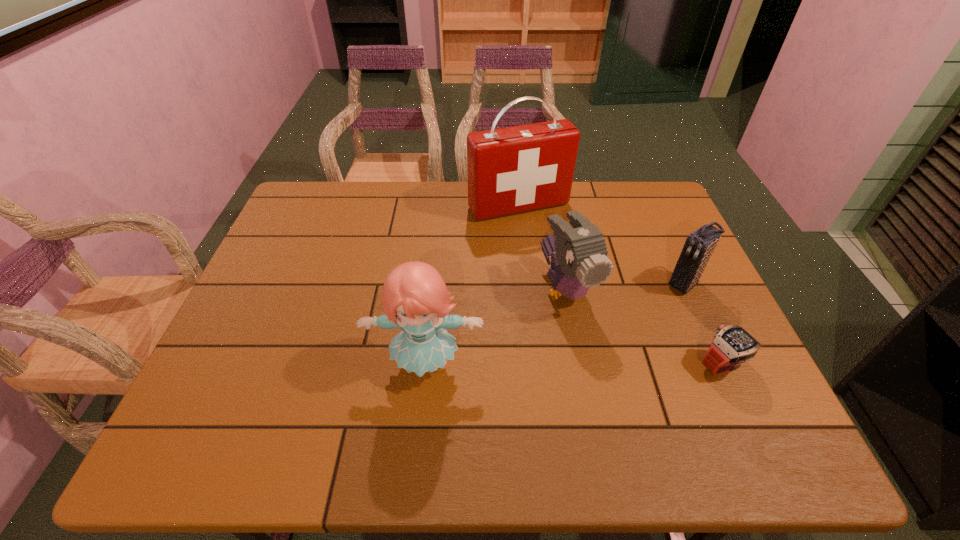
Where is `free space on the desktop that is between the doll and the shortest object and is positioned on the front face of the tallest object`? This screenshot has height=540, width=960. free space on the desktop that is between the doll and the shortest object and is positioned on the front face of the tallest object is located at coordinates (617, 364).

This screenshot has height=540, width=960. Identify the location of free space on the desktop that is between the doll and the watch and is positioned at the beak of the bird. click(616, 364).

The height and width of the screenshot is (540, 960). What are the coordinates of `free space on the desktop that is between the fourth shortest object and the watch and is positioned with the zip open on the clutch bag` in the screenshot? It's located at click(x=582, y=364).